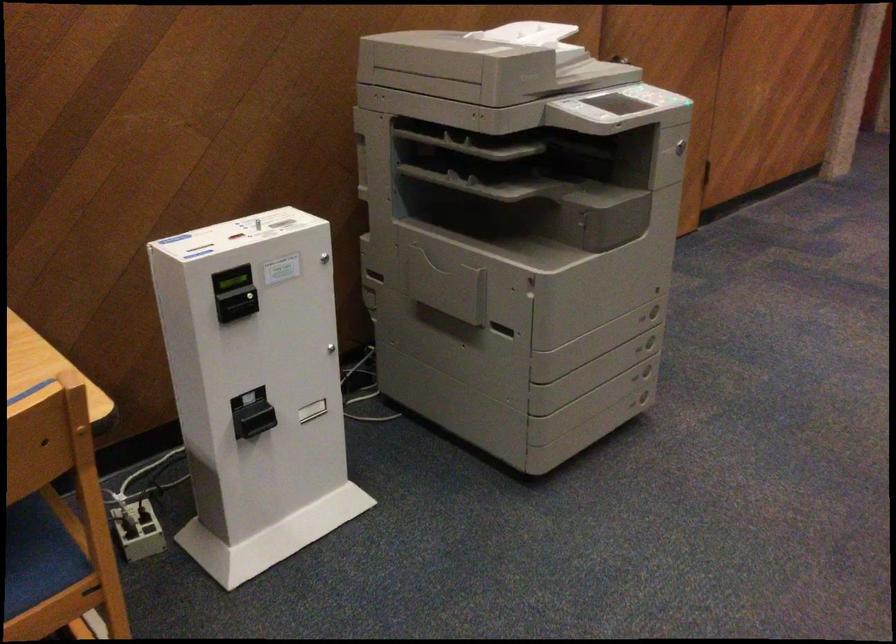
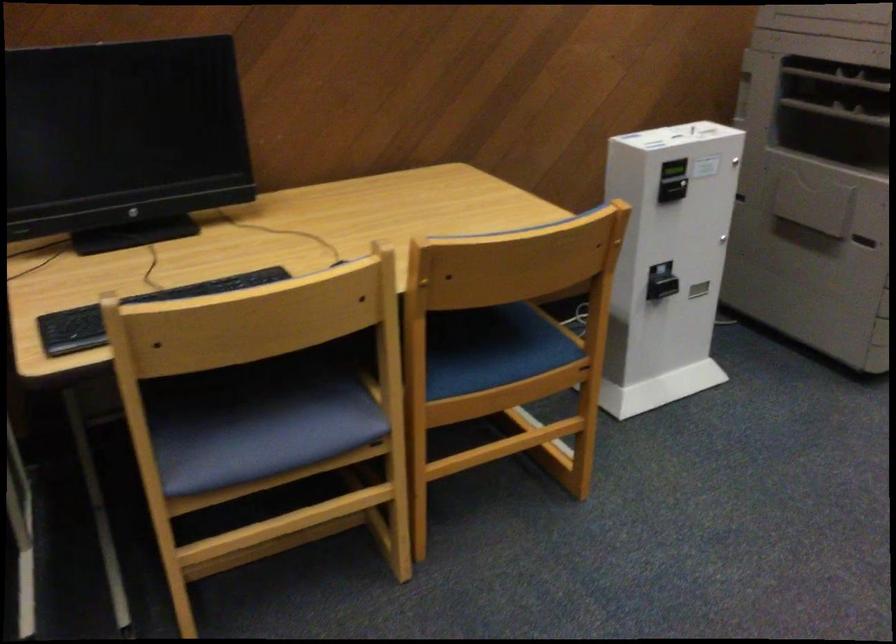
In the second image, find the point that corresponds to point (443, 152) in the first image.

(839, 79)